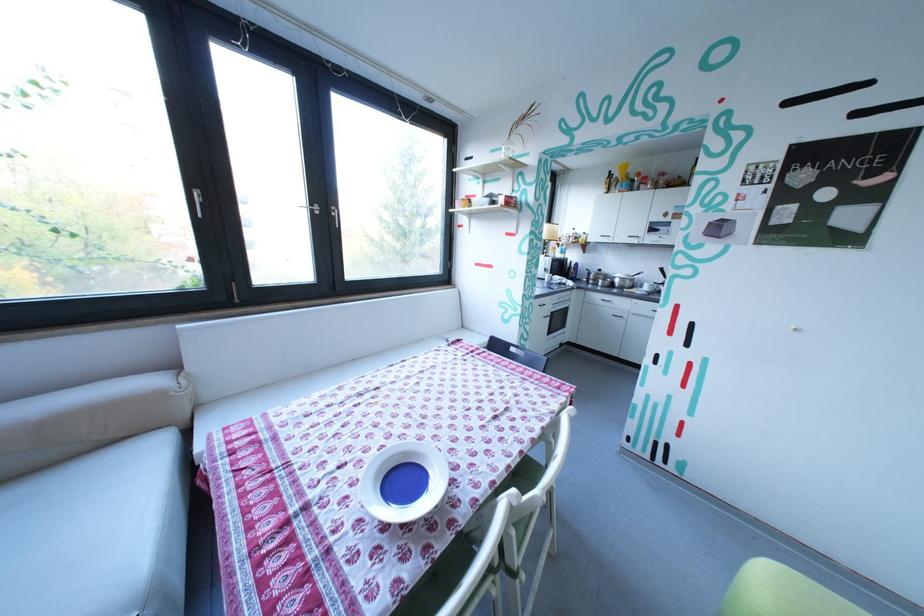
Identify the location of pan handle. The height and width of the screenshot is (616, 924). (624, 280).